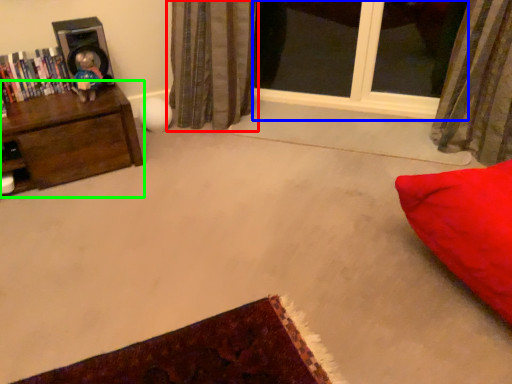
Question: Which is nearer to the curtain (highlighted by a red box)? window (highlighted by a blue box) or furniture (highlighted by a green box).

Choices:
 (A) window
 (B) furniture

Answer: (A)